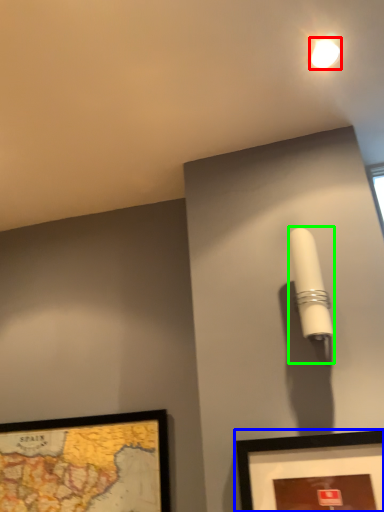
Question: Which object is the farthest from droplight (highlighted by a red box)? Choose among these: picture frame (highlighted by a blue box) or table lamp (highlighted by a green box).

Choices:
 (A) picture frame
 (B) table lamp

Answer: (A)